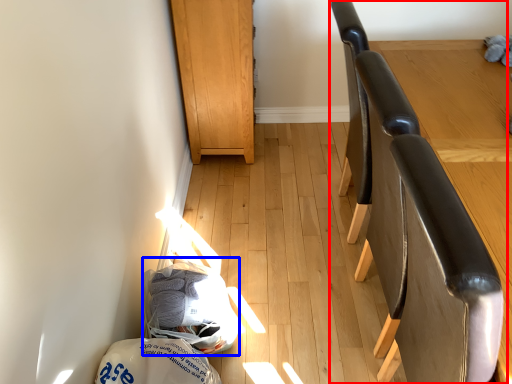
Question: Which point is further to the camera, chair (highlighted by a red box) or material (highlighted by a blue box)?

Choices:
 (A) chair
 (B) material

Answer: (B)